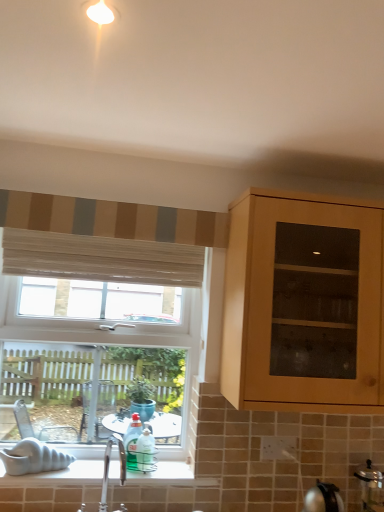
Question: Does striped fabric at upper left, arranged as the 2th curtain when ordered from the bottom, have a larger size compared to clear glass window at lower left?

Choices:
 (A) yes
 (B) no

Answer: (B)

Question: Is striped fabric at upper left, arranged as the 2th curtain when ordered from the bottom, far from clear glass window at lower left?

Choices:
 (A) no
 (B) yes

Answer: (A)

Question: Would you say clear glass window at lower left is part of striped fabric at upper left, which is the first curtain from top to bottom,'s contents?

Choices:
 (A) yes
 (B) no

Answer: (B)

Question: Does striped fabric at upper left, which is the first curtain from top to bottom, come in front of clear glass window at lower left?

Choices:
 (A) no
 (B) yes

Answer: (B)

Question: Can you confirm if striped fabric at upper left, which is the first curtain from top to bottom, is smaller than clear glass window at lower left?

Choices:
 (A) yes
 (B) no

Answer: (A)

Question: Are striped fabric at upper left, arranged as the 2th curtain when ordered from the bottom, and clear glass window at lower left making contact?

Choices:
 (A) no
 (B) yes

Answer: (A)

Question: Is satin silver pressure cooker at lower right oriented away from clear glass window at lower left?

Choices:
 (A) no
 (B) yes

Answer: (A)

Question: Does satin silver pressure cooker at lower right have a lesser height compared to clear glass window at lower left?

Choices:
 (A) yes
 (B) no

Answer: (A)

Question: Is satin silver pressure cooker at lower right smaller than clear glass window at lower left?

Choices:
 (A) yes
 (B) no

Answer: (A)

Question: Are satin silver pressure cooker at lower right and clear glass window at lower left beside each other?

Choices:
 (A) no
 (B) yes

Answer: (A)

Question: Is satin silver pressure cooker at lower right positioned far away from clear glass window at lower left?

Choices:
 (A) no
 (B) yes

Answer: (B)

Question: From the image's perspective, is satin silver pressure cooker at lower right beneath clear glass window at lower left?

Choices:
 (A) yes
 (B) no

Answer: (A)

Question: Considering the relative sizes of wooden blinds at upper left, acting as the 1th curtain starting from the bottom, and satin silver pressure cooker at lower right in the image provided, is wooden blinds at upper left, acting as the 1th curtain starting from the bottom, wider than satin silver pressure cooker at lower right?

Choices:
 (A) yes
 (B) no

Answer: (B)